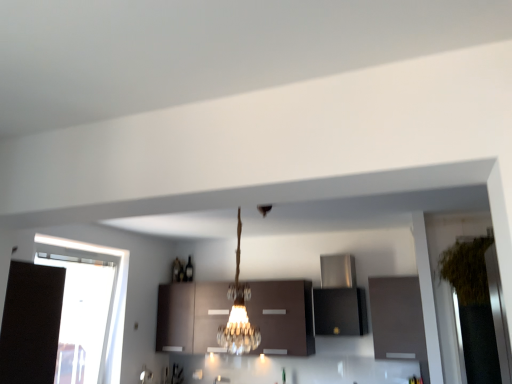
Question: From the image's perspective, is green leafy plant at right positioned above or below matte brown cabinets at center, which is the third cabinetry in right-to-left order?

Choices:
 (A) below
 (B) above

Answer: (B)

Question: Choose the correct answer: Is green leafy plant at right inside matte brown cabinets at center, which is the third cabinetry in right-to-left order, or outside it?

Choices:
 (A) outside
 (B) inside

Answer: (A)

Question: Which of these objects is positioned farthest from the matte brown cabinet at right, the third cabinetry when ordered from left to right?

Choices:
 (A) matte brown cabinets at center, which is the third cabinetry in right-to-left order
 (B) stainless steel range hood at upper center, placed as the second cabinetry when sorted from left to right
 (C) transparent glass window at left
 (D) green leafy plant at right

Answer: (C)

Question: Which of these objects is positioned closest to the matte brown cabinets at center, the 1th cabinetry when ordered from left to right?

Choices:
 (A) stainless steel range hood at upper center, which is the 2th cabinetry in right-to-left order
 (B) green leafy plant at right
 (C) matte brown cabinet at right, marked as the first cabinetry in a right-to-left arrangement
 (D) transparent glass window at left

Answer: (D)